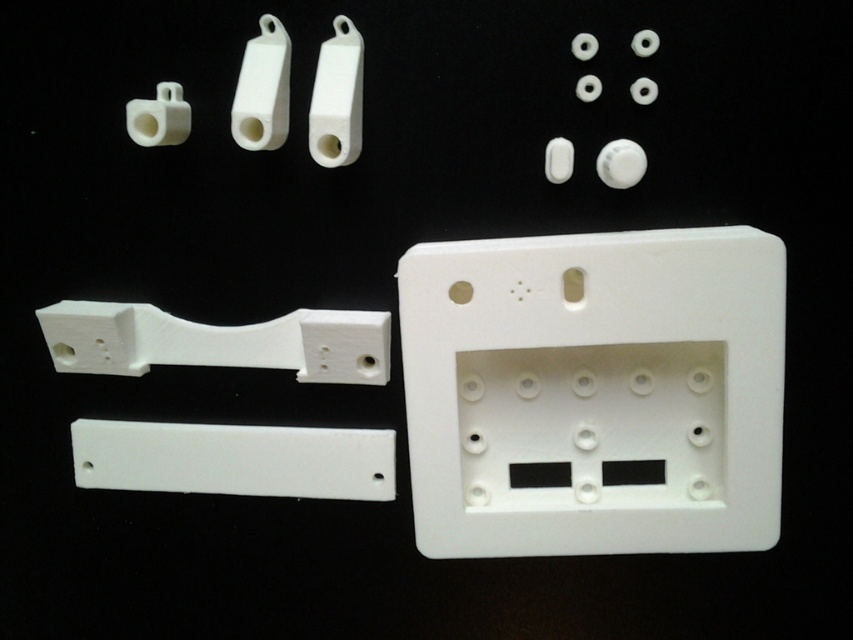
Is point (450, 316) more distant than point (183, 460)?

No, it is not.

Can you confirm if white plastic electric outlet at center is wider than white matte rectangular plate at lower left?

Correct, the width of white plastic electric outlet at center exceeds that of white matte rectangular plate at lower left.

Locate an element on the screen. The width and height of the screenshot is (853, 640). white plastic electric outlet at center is located at coordinates (595, 388).

Find the location of `white plastic electric outlet at center`. white plastic electric outlet at center is located at coordinates (595, 388).